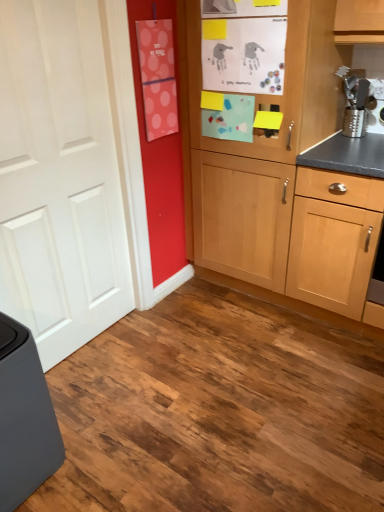
Identify the location of free space in front of white matte door at left. (106, 398).